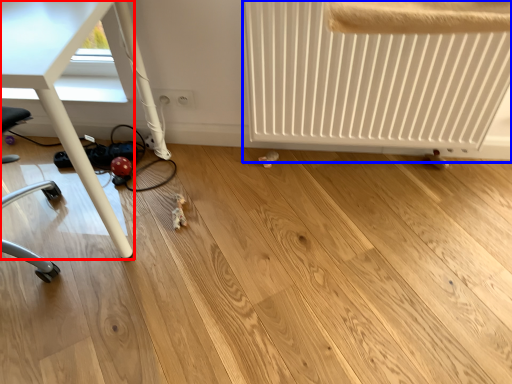
Question: Which point is closer to the camera, table (highlighted by a red box) or radiator (highlighted by a blue box)?

Choices:
 (A) table
 (B) radiator

Answer: (A)